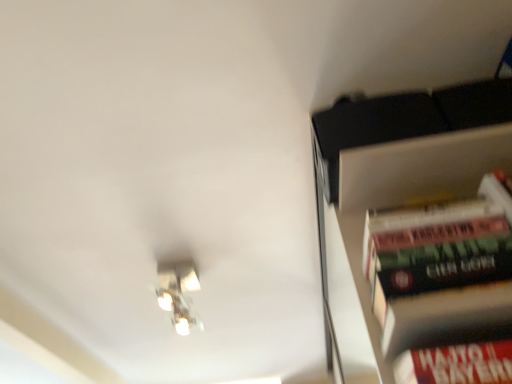
Question: Does hardcover book at right appear on the left side of metallic silver light fixture at upper left?

Choices:
 (A) yes
 (B) no

Answer: (B)

Question: Is hardcover book at right looking in the opposite direction of metallic silver light fixture at upper left?

Choices:
 (A) yes
 (B) no

Answer: (B)

Question: Can metallic silver light fixture at upper left be found inside hardcover book at right?

Choices:
 (A) yes
 (B) no

Answer: (B)

Question: Is hardcover book at right outside of metallic silver light fixture at upper left?

Choices:
 (A) no
 (B) yes

Answer: (B)

Question: Is hardcover book at right in front of metallic silver light fixture at upper left?

Choices:
 (A) no
 (B) yes

Answer: (B)

Question: Does hardcover book at right turn towards metallic silver light fixture at upper left?

Choices:
 (A) yes
 (B) no

Answer: (B)

Question: Is metallic silver light fixture at upper left positioned behind hardcover book at right?

Choices:
 (A) yes
 (B) no

Answer: (A)

Question: Is metallic silver light fixture at upper left turned away from hardcover book at right?

Choices:
 (A) no
 (B) yes

Answer: (A)

Question: Is metallic silver light fixture at upper left positioned before hardcover book at right?

Choices:
 (A) yes
 (B) no

Answer: (B)

Question: Can you confirm if metallic silver light fixture at upper left is positioned to the right of hardcover book at right?

Choices:
 (A) yes
 (B) no

Answer: (B)

Question: Is metallic silver light fixture at upper left thinner than hardcover book at right?

Choices:
 (A) yes
 (B) no

Answer: (B)

Question: Is hardcover book at right surrounded by metallic silver light fixture at upper left?

Choices:
 (A) no
 (B) yes

Answer: (A)

Question: From a real-world perspective, relative to metallic silver light fixture at upper left, is hardcover book at right vertically above or below?

Choices:
 (A) below
 (B) above

Answer: (A)